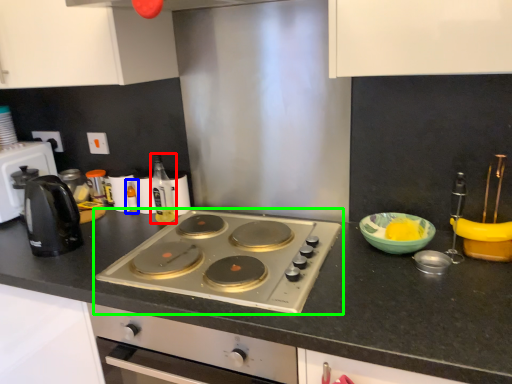
Question: Estimate the real-world distances between objects in this image. Which object is closer to bottle (highlighted by a red box), bottle (highlighted by a blue box) or gas stove (highlighted by a green box)?

Choices:
 (A) bottle
 (B) gas stove

Answer: (A)